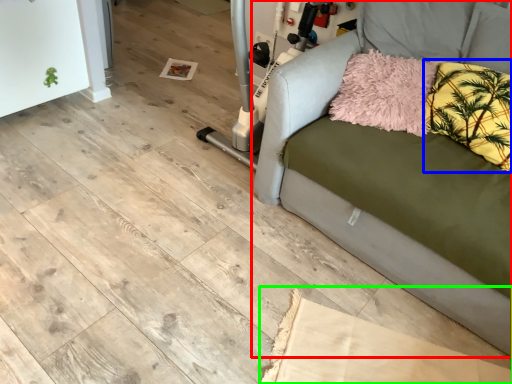
Question: Which is nearer to the studio couch (highlighted by a red box)? pillow (highlighted by a blue box) or cardboard (highlighted by a green box).

Choices:
 (A) pillow
 (B) cardboard

Answer: (A)